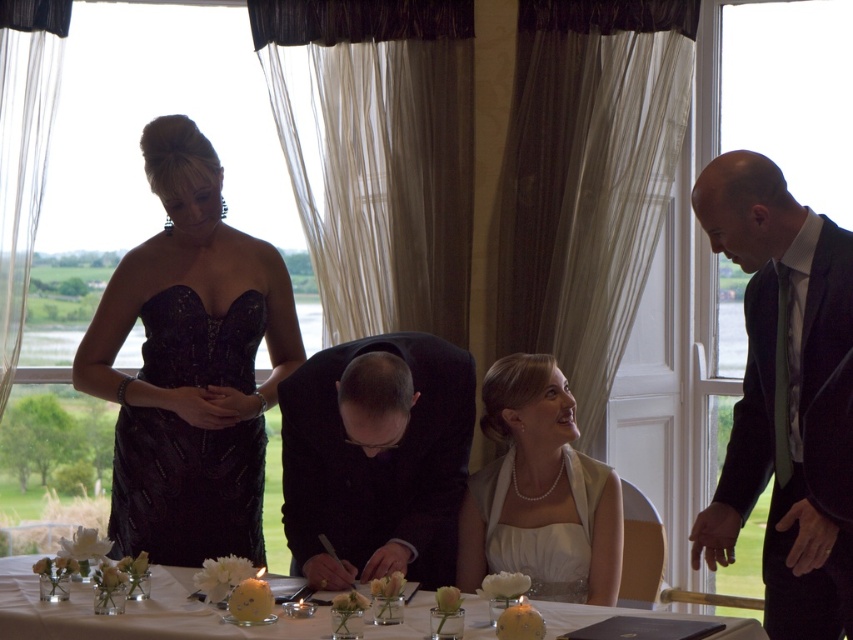
You are a photographer at the event and need to position a camera so that both the black sequined dress at center and the pearl white dress at center are in frame. Given that the camera has a fixed focal length, which dress should you focus on to ensure both are in focus?

The black sequined dress at center is taller than the pearl white dress at center, so focusing on the black sequined dress at center will ensure both are in focus as it is the farther one.

You are a photographer at a formal event. You need to capture a photo of the black satin suit at center and pearl white dress at center. Which one will appear closer to the camera in the photo?

The black satin suit at center will appear closer to the camera in the photo because it is positioned in front of the pearl white dress at center.